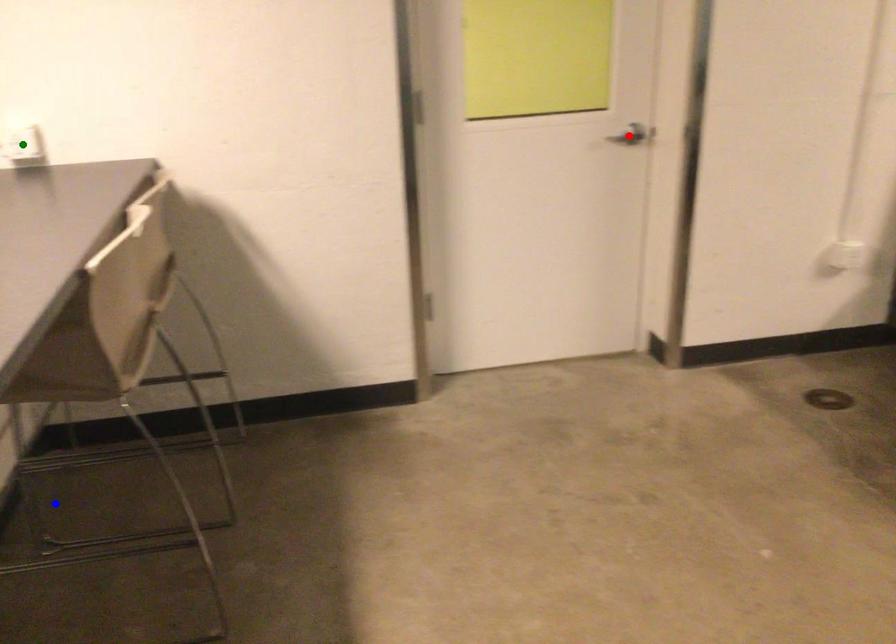
Order these from nearest to farthest:
A) blue point
B) green point
C) red point

green point → blue point → red point